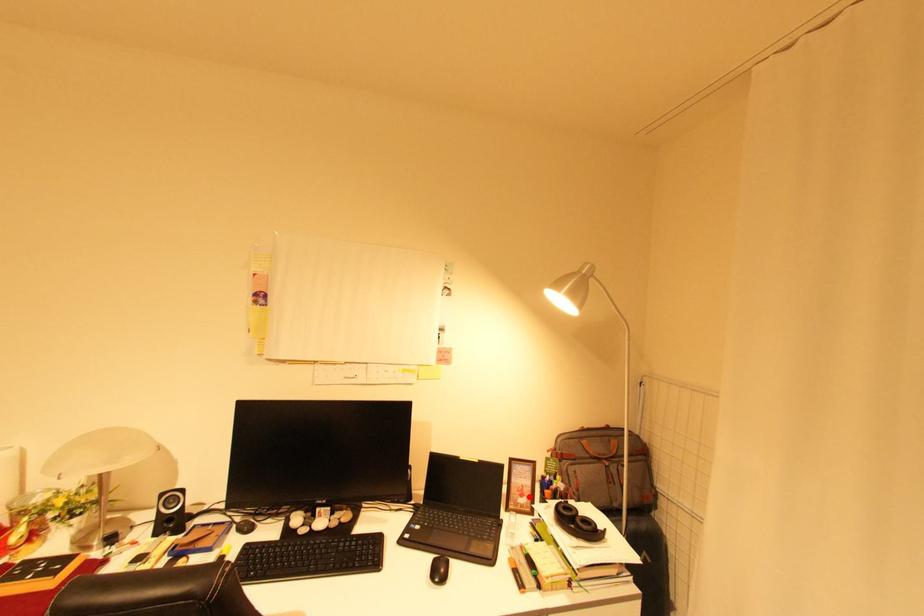
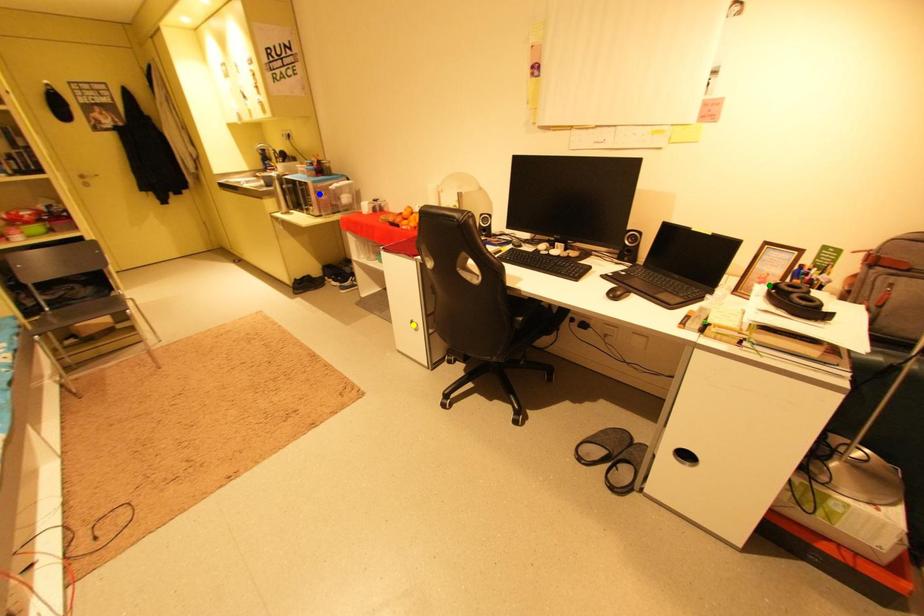
Question: I am providing you with two images of the same scene from different viewpoints. A red point is marked on the first image. You are given multiple points on the second image. Which point in image 2 represents the same 3d spot as the red point in image 1?

Choices:
 (A) yellow point
 (B) green point
 (C) blue point

Answer: (B)